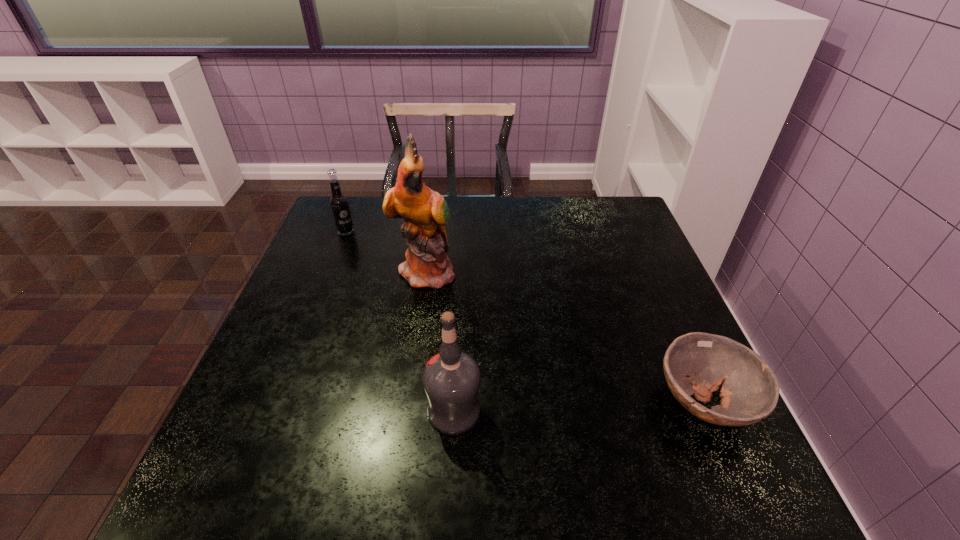
Locate an element on the screen. This screenshot has height=540, width=960. object present at the left edge is located at coordinates (339, 204).

Where is `object that is at the right edge`? The width and height of the screenshot is (960, 540). object that is at the right edge is located at coordinates (697, 363).

The height and width of the screenshot is (540, 960). Find the location of `object that is at the far left corner`. object that is at the far left corner is located at coordinates (339, 204).

At what (x,y) coordinates should I click in order to perform the action: click on object situated at the near right corner. Please return your answer as a coordinate pair (x, y). Looking at the image, I should click on (697, 363).

In order to click on vacant region at the far edge of the desktop in this screenshot , I will do `click(494, 208)`.

Where is `free space at the near edge of the desktop`? free space at the near edge of the desktop is located at coordinates (505, 413).

Identify the location of vacant region at the left edge of the desktop. (x=312, y=269).

Identify the location of free space at the right edge of the desktop. The width and height of the screenshot is (960, 540). (652, 293).

Locate an element on the screen. The height and width of the screenshot is (540, 960). free space at the near left corner of the desktop is located at coordinates (296, 431).

The image size is (960, 540). In the image, there is a desktop. What are the coordinates of `vacant space at the far right corner` in the screenshot? It's located at (594, 233).